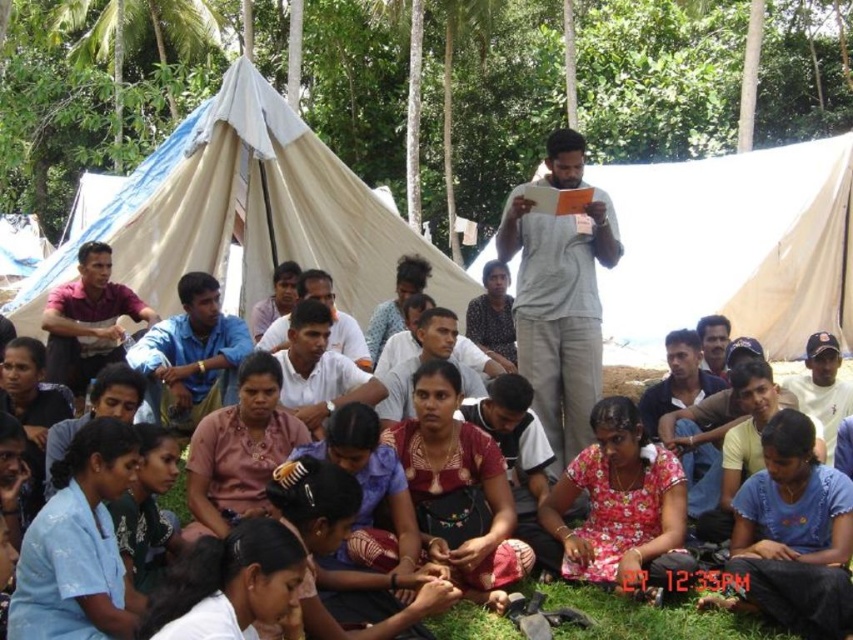
You are standing at a point and want to know how far you are from the location marked by point [305,253]. Can you determine the distance?

The distance between you and point [305,253] is 23.85 meters.

You are standing in the middle of the group under the tent and want to move towards the two points marked in the image. Which point, point (520, 193) or point (749, 637), is closer to you?

Point (520, 193) is closer to you because it is further to the viewer than point (749, 637).